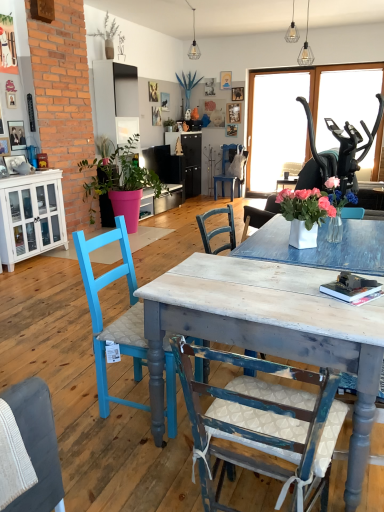
You are a GUI agent. You are given a task and a screenshot of the screen. Output one action in this format:
    pyautogui.click(x=<x>, y=<y>)
    Task: Click on the empty space that is ontop of distressed wood table at center (from a real-world perspective)
    Image resolution: width=384 pixels, height=512 pixels.
    Given the screenshot: What is the action you would take?
    pyautogui.click(x=264, y=283)